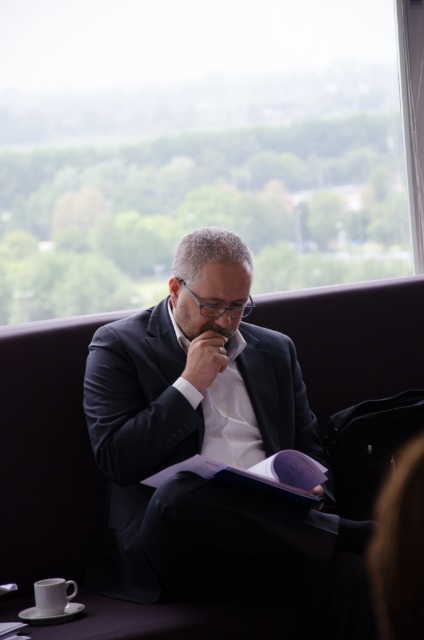
You are a barista preparing a coffee order. You have a white ceramic mug at lower left and a matte skin at center. Which object is bigger in size?

The white ceramic mug at lower left is larger in size than the matte skin at center.

You are standing in the lounge area and want to move from the point at coordinates point (x=55, y=602) to the point at coordinates point (x=233, y=326). Which direction should you move to reach your destination?

To move from point (x=55, y=602) to point (x=233, y=326), you should move backward since point (x=55, y=602) is in front of point (x=233, y=326).